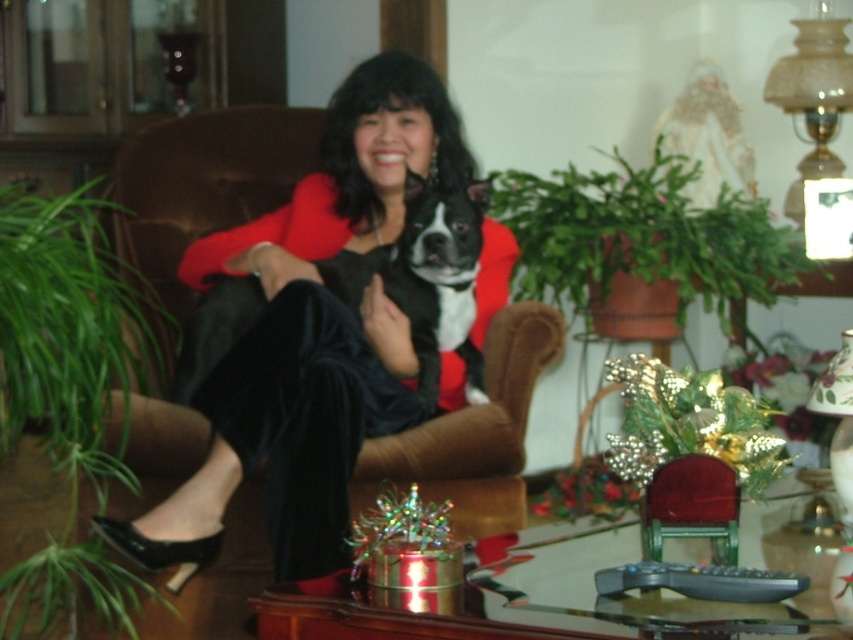
Does velvet black dress at center have a lesser height compared to black and white fur at center?

No.

Does velvet black dress at center appear on the left side of black and white fur at center?

Correct, you'll find velvet black dress at center to the left of black and white fur at center.

Where is `velvet black dress at center`? The height and width of the screenshot is (640, 853). velvet black dress at center is located at coordinates (338, 330).

Image resolution: width=853 pixels, height=640 pixels. What are the coordinates of `velvet black dress at center` in the screenshot? It's located at (338, 330).